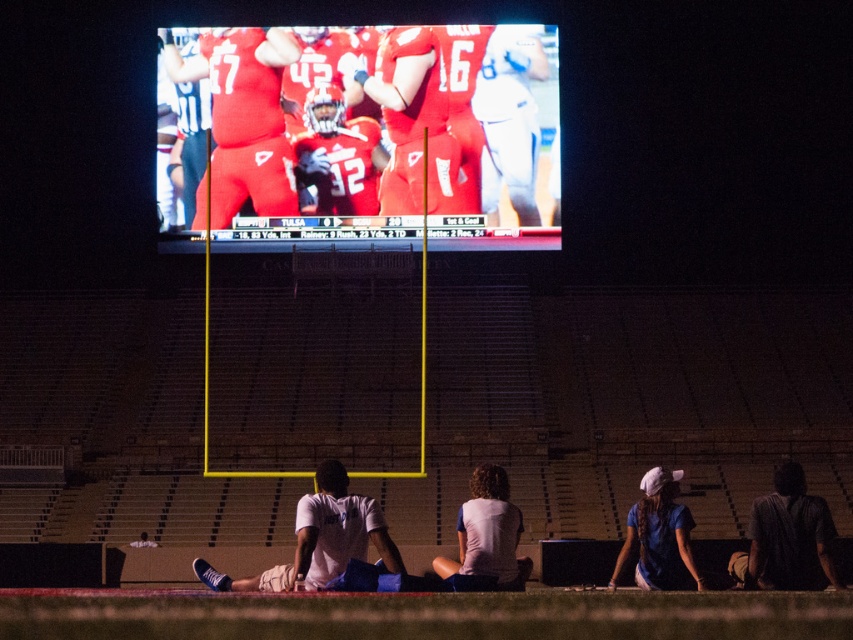
Question: Is matte red uniform at center to the left of matte red jersey at center from the viewer's perspective?

Choices:
 (A) yes
 (B) no

Answer: (A)

Question: Which object appears closest to the camera in this image?

Choices:
 (A) matte red jersey at center
 (B) dark brown textured shirt at lower right
 (C) matte red uniform at center
 (D) white matte shirt at lower center

Answer: (D)

Question: Is the position of matte red uniform at center less distant than that of white matte shirt at lower center?

Choices:
 (A) no
 (B) yes

Answer: (A)

Question: Which point is closer to the camera taking this photo?

Choices:
 (A) (322, 138)
 (B) (619, 561)
 (C) (223, 173)
 (D) (786, 582)

Answer: (D)

Question: From the image, what is the correct spatial relationship of matte red jersey at center in relation to blue cotton shirt at lower right?

Choices:
 (A) left
 (B) right

Answer: (A)

Question: Which point is closer to the camera?

Choices:
 (A) white matte shirt at lower center
 (B) blue cotton shirt at lower right
 (C) dark brown textured shirt at lower right

Answer: (A)